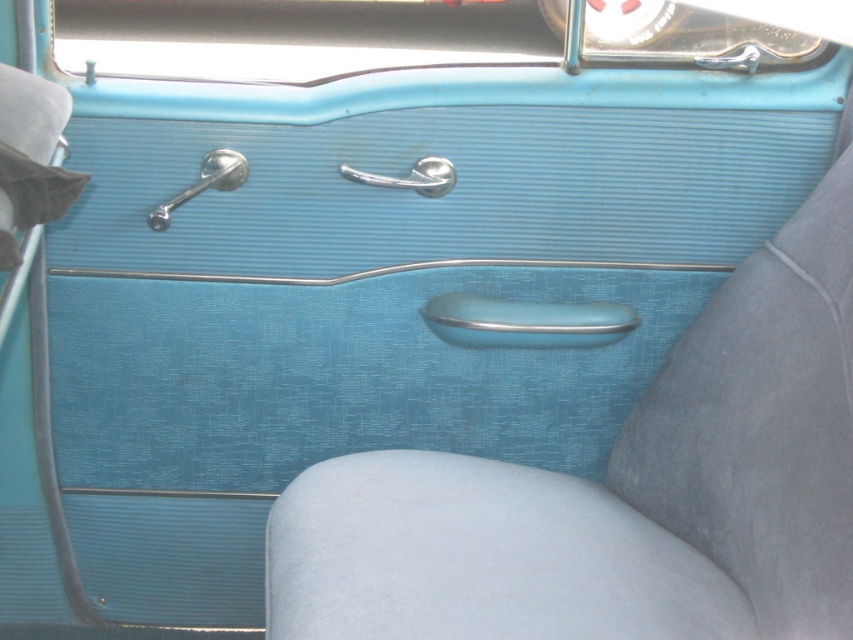
Question: Is metallic blue door handle at center to the right of polished silver door handle at center from the viewer's perspective?

Choices:
 (A) no
 (B) yes

Answer: (B)

Question: Among these points, which one is nearest to the camera?

Choices:
 (A) (418, 164)
 (B) (514, 316)
 (C) (148, 221)

Answer: (C)

Question: Which object is closer to the camera taking this photo?

Choices:
 (A) polished chrome door handle at upper left
 (B) polished silver door handle at center

Answer: (A)

Question: Can you confirm if polished chrome door handle at upper left is positioned below polished silver door handle at center?

Choices:
 (A) yes
 (B) no

Answer: (A)

Question: Can you confirm if polished chrome door handle at upper left is positioned above polished silver door handle at center?

Choices:
 (A) no
 (B) yes

Answer: (A)

Question: Among these points, which one is nearest to the camera?

Choices:
 (A) (525, 310)
 (B) (151, 211)

Answer: (B)